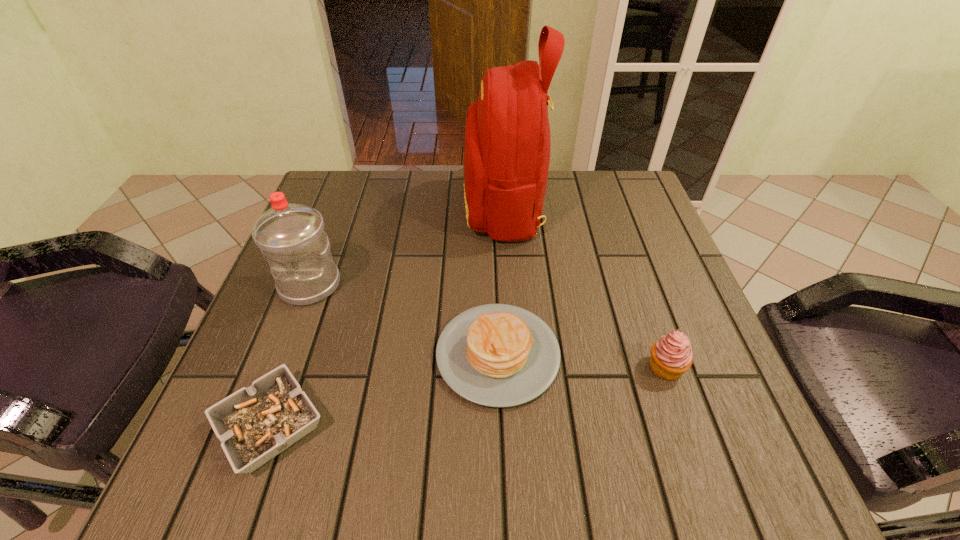
The image size is (960, 540). In order to click on blank area in the image that satisfies the following two spatial constraints: 1. on the back side of the fourth tallest object; 2. on the left side of the shortest object in this screenshot , I will do `click(296, 354)`.

This screenshot has height=540, width=960. What are the coordinates of `vacant space that satisfies the following two spatial constraints: 1. on the handle side of the second shortest object; 2. on the left side of the second tallest object` in the screenshot? It's located at (284, 354).

Where is `vacant space that satisfies the following two spatial constraints: 1. on the front-facing side of the tallest object; 2. on the handle side of the water bottle`? vacant space that satisfies the following two spatial constraints: 1. on the front-facing side of the tallest object; 2. on the handle side of the water bottle is located at coordinates (509, 285).

Locate an element on the screen. This screenshot has height=540, width=960. blank space that satisfies the following two spatial constraints: 1. on the handle side of the shortest object; 2. on the right side of the water bottle is located at coordinates (257, 426).